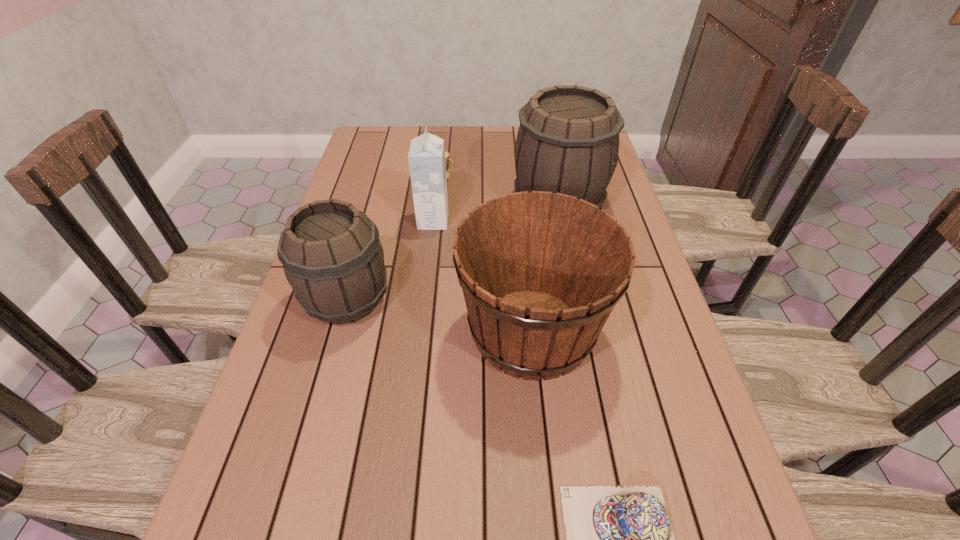
Locate an element on the screen. The height and width of the screenshot is (540, 960). vacant space that satisfies the following two spatial constraints: 1. on the back side of the leftmost object; 2. on the left side of the tallest wine bucket is located at coordinates (374, 202).